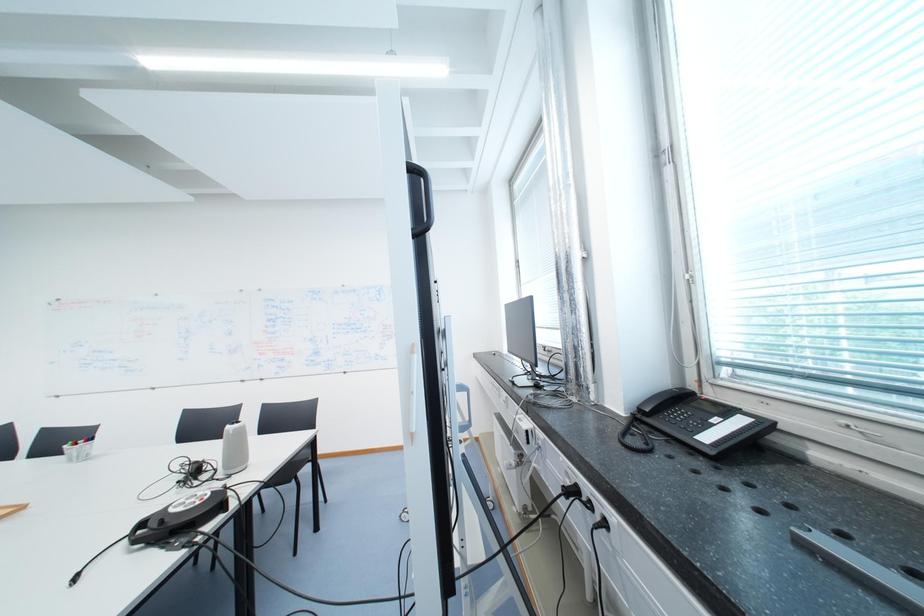
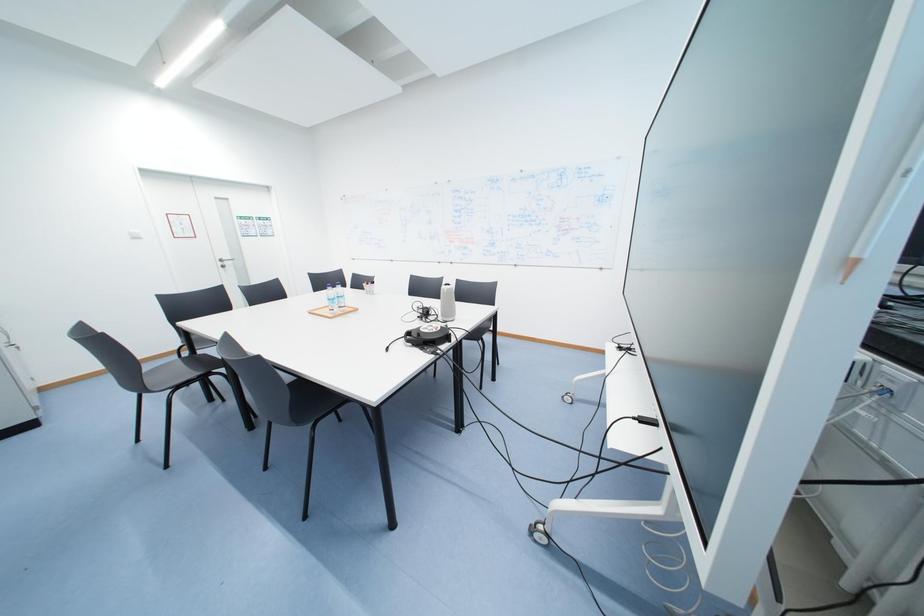
Based on the continuous images, in which direction is the camera rotating?

The camera's rotation is toward left-down.